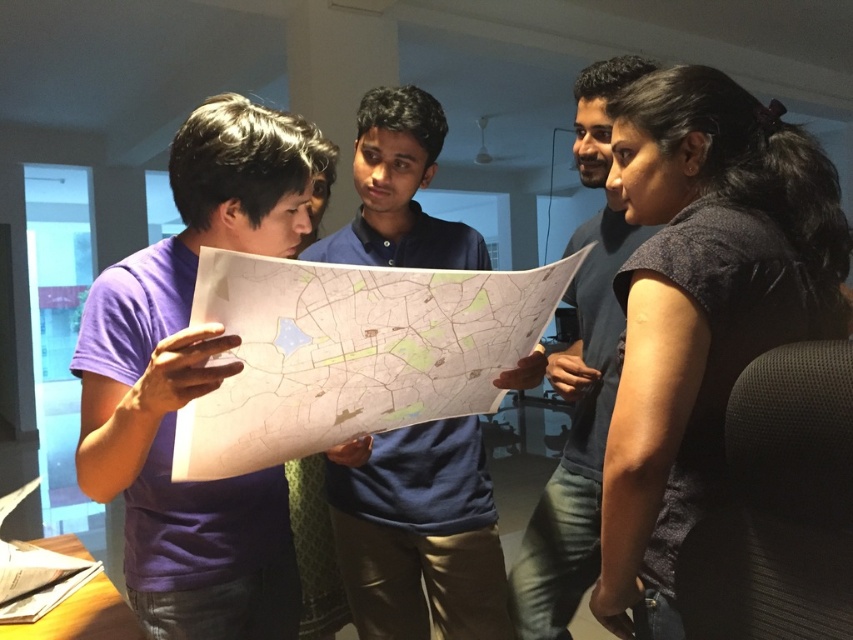
You are a new team member joining the meeting and want to introduce yourself to the dark gray fabric shirt at upper right and the blue cotton shirt at center. Which person should you approach first based on their position?

You should approach the dark gray fabric shirt at upper right first because they are positioned in front of the blue cotton shirt at center, making them closer to you.